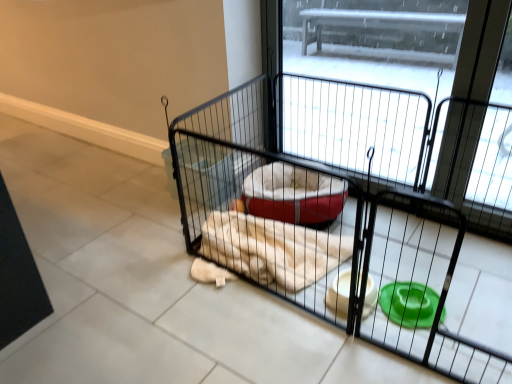
Question: Can you confirm if black wire screen door at center is thinner than black wire cage at center?

Choices:
 (A) no
 (B) yes

Answer: (B)

Question: Considering the relative sizes of black wire screen door at center and black wire cage at center in the image provided, is black wire screen door at center taller than black wire cage at center?

Choices:
 (A) yes
 (B) no

Answer: (A)

Question: From the image's perspective, is black wire screen door at center on top of black wire cage at center?

Choices:
 (A) no
 (B) yes

Answer: (B)

Question: Considering the relative sizes of black wire screen door at center and black wire cage at center in the image provided, is black wire screen door at center shorter than black wire cage at center?

Choices:
 (A) no
 (B) yes

Answer: (A)

Question: Does black wire screen door at center have a greater width compared to black wire cage at center?

Choices:
 (A) yes
 (B) no

Answer: (B)

Question: Is black wire screen door at center with black wire cage at center?

Choices:
 (A) no
 (B) yes

Answer: (A)

Question: Is black wire cage at center behind black wire screen door at center?

Choices:
 (A) yes
 (B) no

Answer: (B)

Question: Is black wire cage at center taller than black wire screen door at center?

Choices:
 (A) yes
 (B) no

Answer: (B)

Question: Is black wire cage at center far away from black wire screen door at center?

Choices:
 (A) yes
 (B) no

Answer: (B)

Question: Does black wire cage at center have a lesser width compared to black wire screen door at center?

Choices:
 (A) yes
 (B) no

Answer: (B)

Question: From the image's perspective, is black wire cage at center under black wire screen door at center?

Choices:
 (A) yes
 (B) no

Answer: (A)

Question: Can you confirm if black wire cage at center is positioned to the left of black wire screen door at center?

Choices:
 (A) yes
 (B) no

Answer: (A)

Question: In the image, is black wire cage at center on the left side or the right side of black wire screen door at center?

Choices:
 (A) left
 (B) right

Answer: (A)